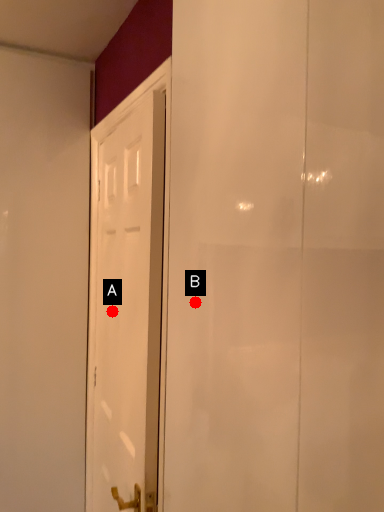
Question: Two points are circled on the image, labeled by A and B beside each circle. Which point is farther from the camera taking this photo?

Choices:
 (A) A is further
 (B) B is further

Answer: (A)